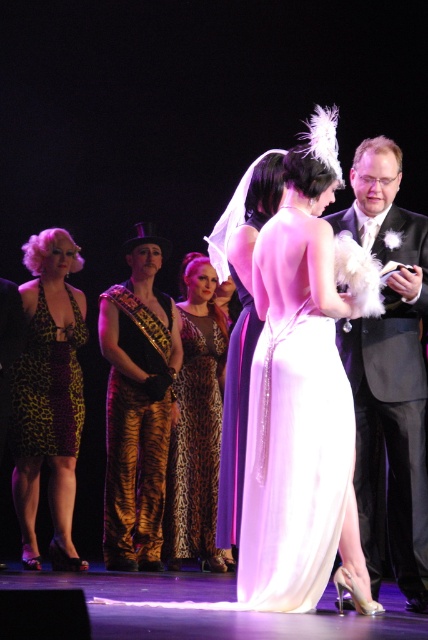
Does shiny black suit at right appear under tiger print pants at left?

Actually, shiny black suit at right is above tiger print pants at left.

Does shiny black suit at right appear on the right side of tiger print pants at left?

Indeed, shiny black suit at right is positioned on the right side of tiger print pants at left.

Between point (386, 184) and point (149, 440), which one is positioned in front?

Point (386, 184)

At what (x,y) coordinates should I click in order to perform the action: click on shiny black suit at right. Please return your answer as a coordinate pair (x, y). This screenshot has width=428, height=640. Looking at the image, I should click on (389, 374).

Between purple satin dress at center and leopard print fabric dress at left, which one is positioned higher?

purple satin dress at center

Is point (285, 225) less distant than point (32, 426)?

That is True.

Is point (335, 355) more distant than point (50, 387)?

No, (335, 355) is closer to viewer.

Identify the location of purple satin dress at center. (300, 406).

Between point (353, 376) and point (199, 392), which one is positioned behind?

Point (199, 392)

Is point (386, 528) positioned in front of point (211, 545)?

Yes, point (386, 528) is closer to viewer.

Which is in front, point (410, 444) or point (219, 384)?

Positioned in front is point (410, 444).

At what (x,y) coordinates should I click in order to perform the action: click on shiny black suit at right. Please return your answer as a coordinate pair (x, y). This screenshot has width=428, height=640. Looking at the image, I should click on (389, 374).